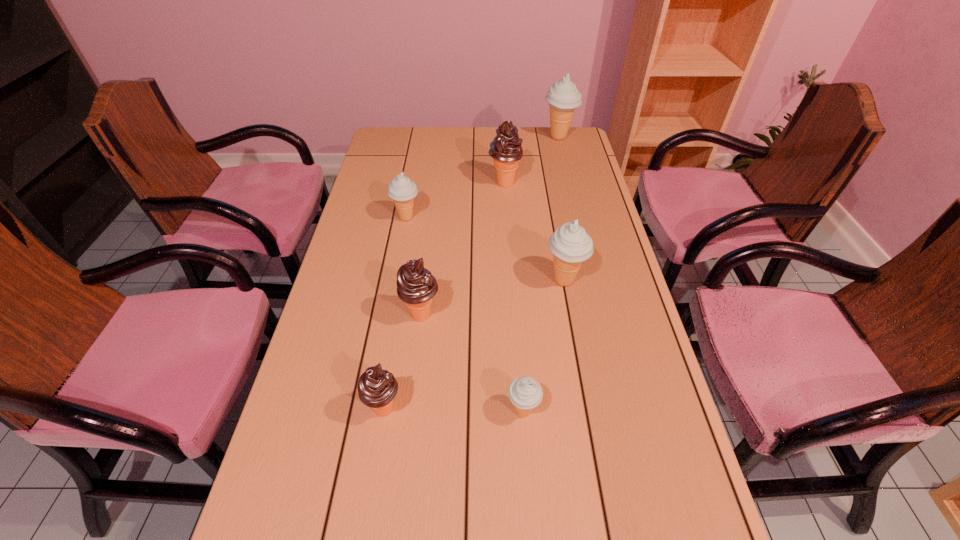
Locate an element on the screen. Image resolution: width=960 pixels, height=540 pixels. object positioned at the far edge is located at coordinates (563, 97).

Find the location of a particular element. object that is at the far right corner is located at coordinates (563, 97).

You are a GUI agent. You are given a task and a screenshot of the screen. Output one action in this format:
    pyautogui.click(x=<x>, y=<y>)
    Task: Click on the free space at the far edge of the desktop
    The height and width of the screenshot is (540, 960).
    Given the screenshot: What is the action you would take?
    pyautogui.click(x=482, y=149)

Where is `free spot at the left edge of the desktop`? free spot at the left edge of the desktop is located at coordinates (347, 245).

This screenshot has height=540, width=960. What are the coordinates of `free space at the right edge of the desktop` in the screenshot? It's located at (582, 163).

What are the coordinates of `vacant space that's between the shortest object and the second nearest chocolate icecream` in the screenshot? It's located at pyautogui.click(x=472, y=364).

Where is `vacant area that lies between the second smallest beige icecream and the nearest chocolate icecream`? The image size is (960, 540). vacant area that lies between the second smallest beige icecream and the nearest chocolate icecream is located at coordinates (396, 314).

Where is `free space between the fourth nearest icecream and the third nearest beige icecream`? free space between the fourth nearest icecream and the third nearest beige icecream is located at coordinates pos(486,249).

Image resolution: width=960 pixels, height=540 pixels. Identify the location of free spot between the third beige icecream from right to left and the fourth nearest object. (543, 346).

Find the location of a particular element. Image resolution: width=960 pixels, height=540 pixels. vacant space that is in between the second smallest chocolate icecream and the farthest object is located at coordinates (490, 226).